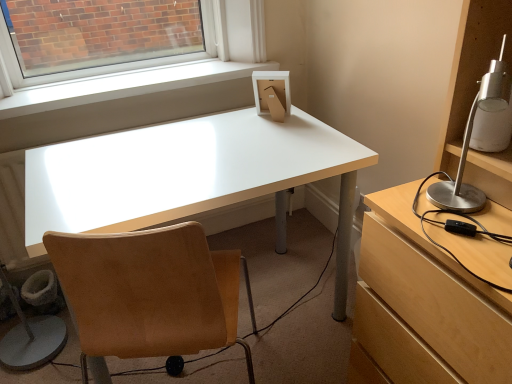
What do you see at coordinates (149, 292) in the screenshot?
I see `tan suede chair at center` at bounding box center [149, 292].

Where is `tan suede chair at center`? This screenshot has height=384, width=512. tan suede chair at center is located at coordinates (149, 292).

Is white smooth window sill at upper center positioned in front of tan suede chair at center?

No, it is not.

Is white smooth window sill at upper center looking in the opposite direction of tan suede chair at center?

No, white smooth window sill at upper center's orientation is not away from tan suede chair at center.

Is white smooth window sill at upper center not inside tan suede chair at center?

Yes, white smooth window sill at upper center is outside of tan suede chair at center.

Which point is more distant from viewer, (16, 115) or (123, 245)?

Positioned behind is point (16, 115).

Does white smooth window sill at upper center turn towards white glossy desk at center?

No, white smooth window sill at upper center is not facing towards white glossy desk at center.

Is white smooth window sill at upper center taller or shorter than white glossy desk at center?

Clearly, white smooth window sill at upper center is shorter compared to white glossy desk at center.

Based on the photo, considering the positions of objects white smooth window sill at upper center and white glossy desk at center in the image provided, who is more to the right, white smooth window sill at upper center or white glossy desk at center?

white glossy desk at center.

Identify the location of desk below the white smooth window sill at upper center (from a real-world perspective). (188, 176).

Does point (227, 152) appear closer or farther from the camera than point (156, 231)?

Point (227, 152) appears to be farther away from the viewer than point (156, 231).

Which is correct: white glossy desk at center is inside tan suede chair at center, or outside of it?

white glossy desk at center cannot be found inside tan suede chair at center.

From a real-world perspective, relative to tan suede chair at center, is white glossy desk at center vertically above or below?

white glossy desk at center is situated lower than tan suede chair at center in the real world.

From a real-world perspective, is white glossy desk at center under white smooth window sill at upper center?

Yes.

From their relative heights in the image, would you say white glossy desk at center is taller or shorter than white smooth window sill at upper center?

Considering their sizes, white glossy desk at center has more height than white smooth window sill at upper center.

Can you confirm if white glossy desk at center is positioned to the right of white smooth window sill at upper center?

Indeed, white glossy desk at center is positioned on the right side of white smooth window sill at upper center.

Is white glossy desk at center oriented away from white smooth window sill at upper center?

That's right, white glossy desk at center is facing away from white smooth window sill at upper center.

Consider the image. Does silver metallic lamp at right have a smaller size compared to white glossy desk at center?

Indeed, silver metallic lamp at right has a smaller size compared to white glossy desk at center.

From a real-world perspective, relative to white glossy desk at center, is silver metallic lamp at right vertically above or below?

In terms of real-world spatial position, silver metallic lamp at right is above white glossy desk at center.

Is silver metallic lamp at right located outside white glossy desk at center?

Indeed, silver metallic lamp at right is completely outside white glossy desk at center.

Does silver metallic lamp at right appear on the right side of white glossy desk at center?

Yes, silver metallic lamp at right is to the right of white glossy desk at center.

Would you say silver metallic lamp at right is part of white smooth window sill at upper center's contents?

No, silver metallic lamp at right is located outside of white smooth window sill at upper center.

In the image, is white smooth window sill at upper center on the left side or the right side of silver metallic lamp at right?

Clearly, white smooth window sill at upper center is on the left of silver metallic lamp at right in the image.

Would you say white smooth window sill at upper center is a long distance from silver metallic lamp at right?

Indeed, white smooth window sill at upper center is not near silver metallic lamp at right.

At what (x,y) coordinates should I click in order to perform the action: click on lamp above the white smooth window sill at upper center (from a real-world perspective). Please return your answer as a coordinate pair (x, y). Image resolution: width=512 pixels, height=384 pixels. Looking at the image, I should click on (469, 143).

Does tan suede chair at center have a greater height compared to white smooth window sill at upper center?

Yes, tan suede chair at center is taller than white smooth window sill at upper center.

From the image's perspective, is tan suede chair at center above white smooth window sill at upper center?

Incorrect, from the image's perspective, tan suede chair at center is lower than white smooth window sill at upper center.

Is tan suede chair at center facing towards white smooth window sill at upper center?

Yes, tan suede chair at center is oriented towards white smooth window sill at upper center.

Is tan suede chair at center in front of or behind white smooth window sill at upper center in the image?

tan suede chair at center is in front of white smooth window sill at upper center.

Locate an element on the screen. This screenshot has width=512, height=384. chair in front of the white smooth window sill at upper center is located at coordinates (149, 292).

Identify the location of window sill lying above the white glossy desk at center (from the image's perspective). This screenshot has height=384, width=512. (125, 85).

Which object lies further to the anchor point tan suede chair at center, silver metallic lamp at right or white glossy desk at center?

The object further to tan suede chair at center is silver metallic lamp at right.

Estimate the real-world distances between objects in this image. Which object is closer to white smooth window sill at upper center, silver metallic lamp at right or tan suede chair at center?

tan suede chair at center.

Based on their spatial positions, is white glossy desk at center or white smooth window sill at upper center further from tan suede chair at center?

The object further to tan suede chair at center is white smooth window sill at upper center.

Considering their positions, is silver metallic lamp at right positioned closer to white smooth window sill at upper center than white glossy desk at center?

white glossy desk at center is closer to white smooth window sill at upper center.

Looking at the image, which one is located further to silver metallic lamp at right, white glossy desk at center or white smooth window sill at upper center?

Based on the image, white smooth window sill at upper center appears to be further to silver metallic lamp at right.

Which object lies nearer to the anchor point silver metallic lamp at right, white smooth window sill at upper center or white glossy desk at center?

Among the two, white glossy desk at center is located nearer to silver metallic lamp at right.

Based on their spatial positions, is tan suede chair at center or white glossy desk at center further from silver metallic lamp at right?

white glossy desk at center is positioned further to the anchor silver metallic lamp at right.

Looking at the image, which one is located further to white smooth window sill at upper center, tan suede chair at center or silver metallic lamp at right?

silver metallic lamp at right is further to white smooth window sill at upper center.

Locate an element on the screen. desk between white smooth window sill at upper center and silver metallic lamp at right is located at coordinates (188, 176).

The width and height of the screenshot is (512, 384). Find the location of `desk between white smooth window sill at upper center and tan suede chair at center vertically`. desk between white smooth window sill at upper center and tan suede chair at center vertically is located at coordinates (188, 176).

Where is `chair between white smooth window sill at upper center and silver metallic lamp at right`? chair between white smooth window sill at upper center and silver metallic lamp at right is located at coordinates (149, 292).

Locate an element on the screen. This screenshot has width=512, height=384. desk situated between tan suede chair at center and silver metallic lamp at right from left to right is located at coordinates (188, 176).